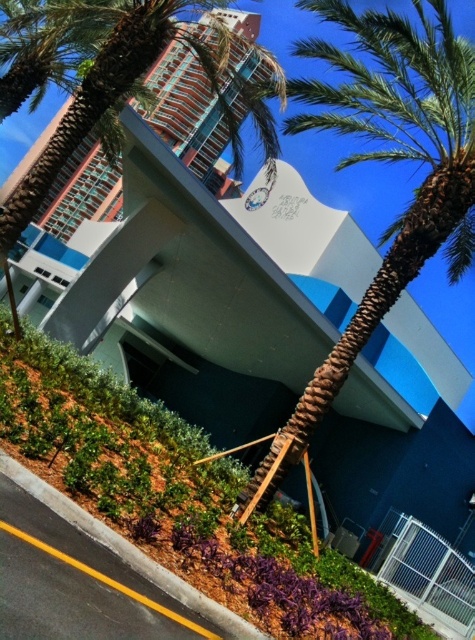
Where is `brown textured palm tree at center`? The width and height of the screenshot is (475, 640). brown textured palm tree at center is located at coordinates (387, 161).

Measure the distance between brown textured palm tree at center and camera.

They are 22.42 feet apart.

Locate an element on the screen. This screenshot has height=640, width=475. brown textured palm tree at center is located at coordinates (387, 161).